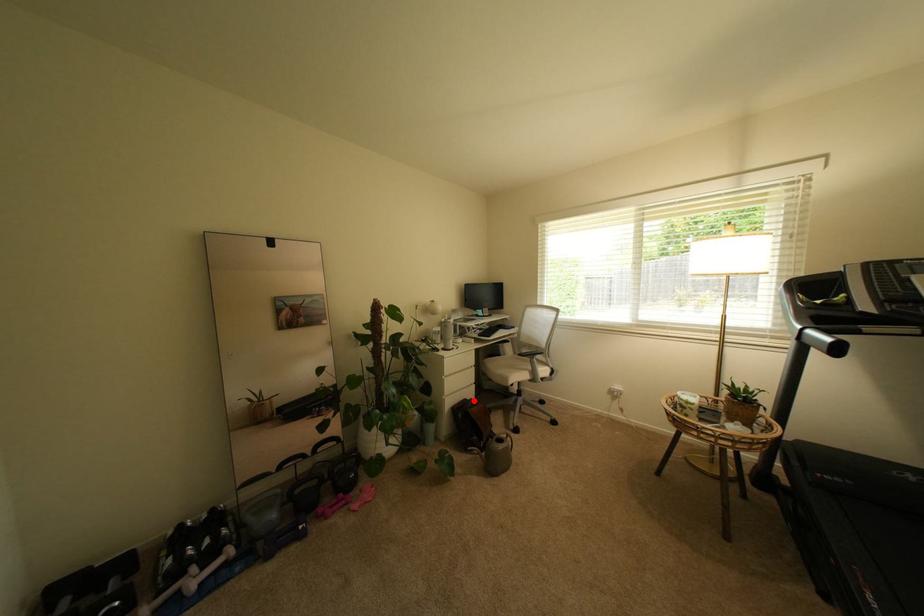
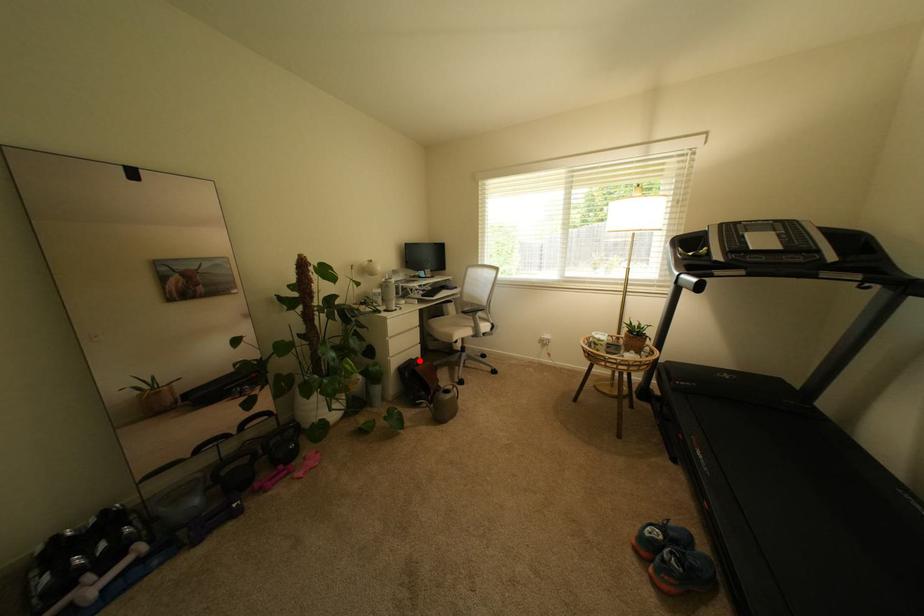
I am providing you with two images of the same scene from different viewpoints. A red point is marked on the first image and another point is marked on the second image. Is the marked point in image1 the same physical position as the marked point in image2?

Yes